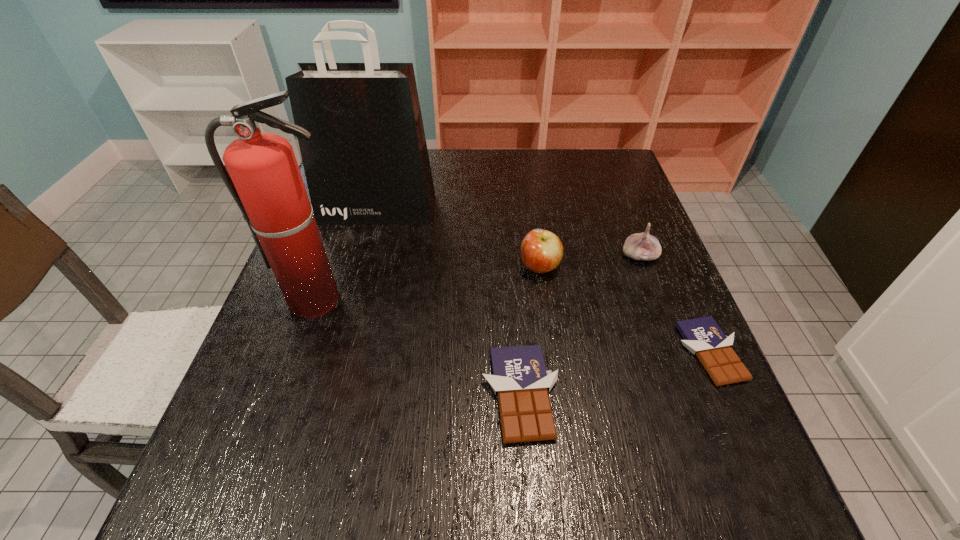
The chocolate bars are evenly distributed in the image. To maintain this, where would you place another chocolate bar on the left? Please point to a free space. Please provide its 2D coordinates. Your answer should be formatted as a tuple, i.e. [(x, y)], where the tuple contains the x and y coordinates of a point satisfying the conditions above.

[(300, 444)]